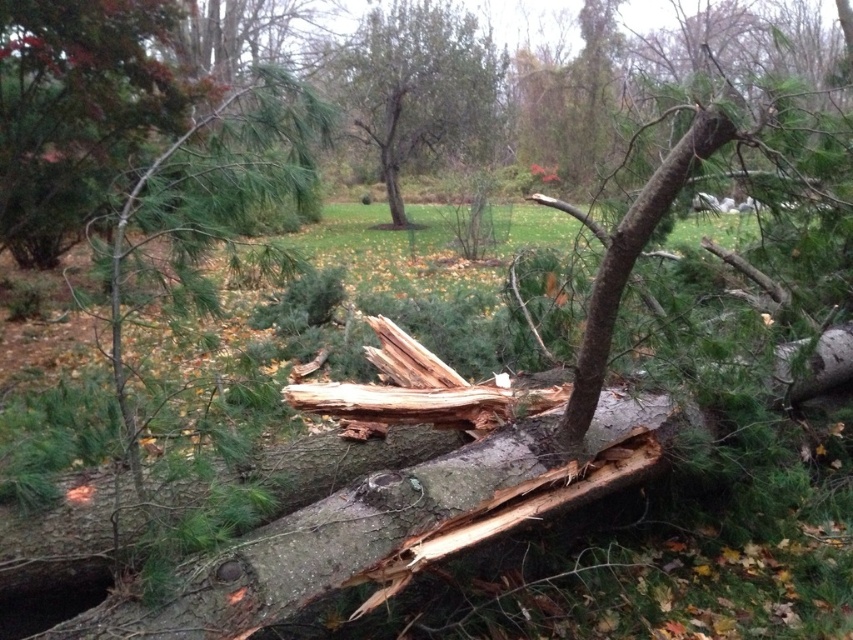
Question: Does smooth bark log at center have a lesser width compared to green rough bark tree at center?

Choices:
 (A) yes
 (B) no

Answer: (A)

Question: Can you confirm if smooth bark log at center is positioned to the left of green rough bark tree at center?

Choices:
 (A) no
 (B) yes

Answer: (A)

Question: Is green matte pine branch at upper left positioned in front of green rough bark tree at center?

Choices:
 (A) yes
 (B) no

Answer: (A)

Question: Which point appears farthest from the camera in this image?

Choices:
 (A) (42, 220)
 (B) (395, 49)
 (C) (643, 442)

Answer: (B)

Question: Which point appears farthest from the camera in this image?

Choices:
 (A) (4, 202)
 (B) (383, 68)
 (C) (229, 586)

Answer: (B)

Question: Which of these objects is positioned farthest from the smooth bark log at center?

Choices:
 (A) green rough bark tree at center
 (B) green matte pine branch at upper left

Answer: (A)